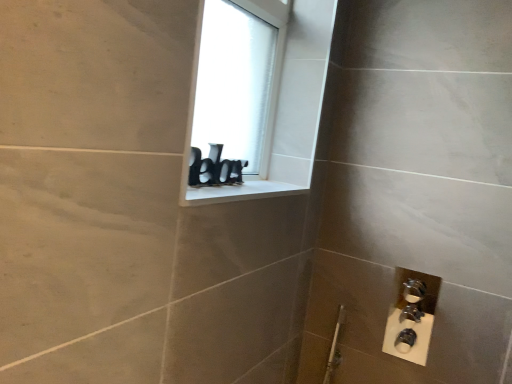
Question: From the image's perspective, is white matte window screen at upper center above or below white glossy window sill at upper center?

Choices:
 (A) above
 (B) below

Answer: (A)

Question: Considering the positions of white matte window screen at upper center and white glossy window sill at upper center in the image, is white matte window screen at upper center taller or shorter than white glossy window sill at upper center?

Choices:
 (A) tall
 (B) short

Answer: (A)

Question: Is white matte window screen at upper center to the left or to the right of white glossy window sill at upper center in the image?

Choices:
 (A) right
 (B) left

Answer: (B)

Question: Visually, is white glossy window sill at upper center positioned to the left or to the right of white matte window screen at upper center?

Choices:
 (A) right
 (B) left

Answer: (A)

Question: Considering the positions of point (230, 198) and point (205, 44), is point (230, 198) closer or farther from the camera than point (205, 44)?

Choices:
 (A) closer
 (B) farther

Answer: (A)

Question: Relative to white matte window screen at upper center, is white glossy window sill at upper center in front or behind?

Choices:
 (A) front
 (B) behind

Answer: (A)

Question: Is white glossy window sill at upper center taller or shorter than white matte window screen at upper center?

Choices:
 (A) short
 (B) tall

Answer: (A)